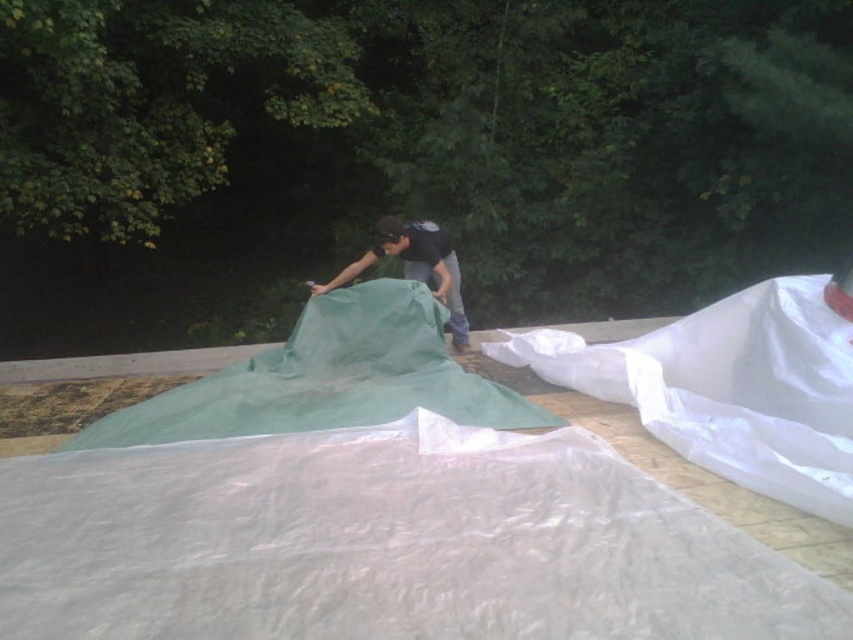
From the picture: Measure the distance between point (x=456, y=417) and camera.

A distance of 3.52 meters exists between point (x=456, y=417) and camera.

Who is higher up, green fabric blanket at center or matte green tarp at center?

matte green tarp at center is above.

Who is more distant from viewer, (376, 346) or (432, 224)?

Positioned behind is point (432, 224).

This screenshot has width=853, height=640. I want to click on green fabric blanket at center, so click(328, 378).

Can you confirm if transparent plastic sheet at center is wider than white translucent sheet at right?

Indeed, transparent plastic sheet at center has a greater width compared to white translucent sheet at right.

Is transparent plastic sheet at center closer to camera compared to white translucent sheet at right?

Yes, transparent plastic sheet at center is in front of white translucent sheet at right.

Measure the distance between point (190,509) and camera.

Point (190,509) and camera are 2.61 meters apart.

Locate an element on the screen. transparent plastic sheet at center is located at coordinates (384, 544).

Does white translucent sheet at right appear on the right side of matte green tarp at center?

Indeed, white translucent sheet at right is positioned on the right side of matte green tarp at center.

Can you confirm if white translucent sheet at right is wider than matte green tarp at center?

Yes.

Is point (549, 365) farther from viewer compared to point (422, 243)?

No, it is not.

Find the location of a particular element. white translucent sheet at right is located at coordinates (729, 388).